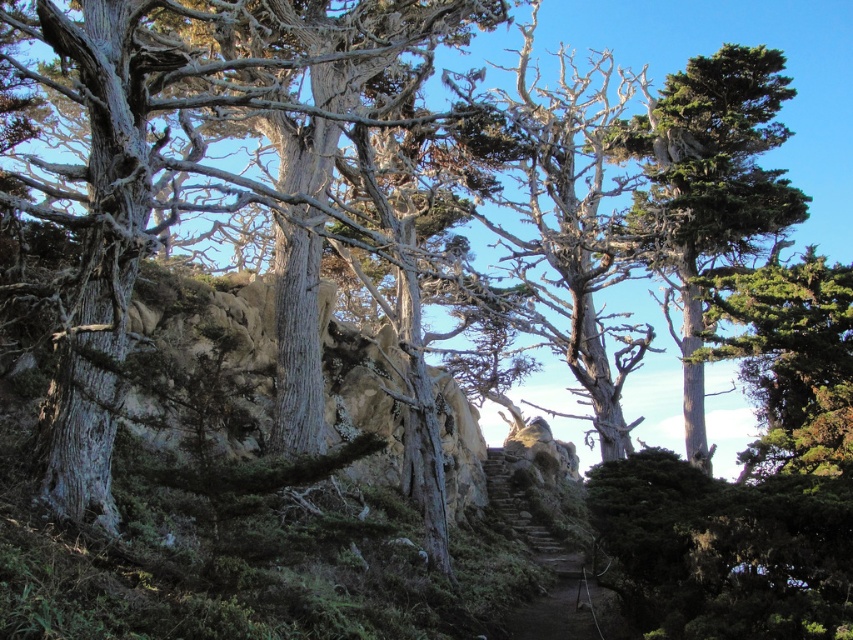
Who is positioned more to the left, green textured tree at upper right or brown stone stairs at center?

brown stone stairs at center

Find the location of a particular element. green textured tree at upper right is located at coordinates (706, 188).